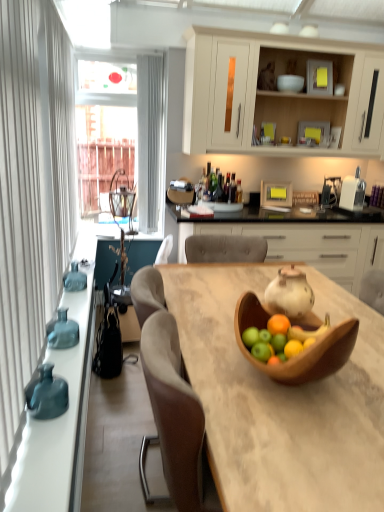
Question: Is matte white cabinet at upper center, marked as the first cabinetry in a top-to-bottom arrangement, inside wooden table at center?

Choices:
 (A) no
 (B) yes

Answer: (A)

Question: Is wooden table at center positioned in front of matte white cabinet at upper center, which appears as the second cabinetry when ordered from the bottom?

Choices:
 (A) yes
 (B) no

Answer: (A)

Question: Is the position of wooden table at center more distant than that of matte white cabinet at upper center, marked as the first cabinetry in a top-to-bottom arrangement?

Choices:
 (A) yes
 (B) no

Answer: (B)

Question: Are wooden table at center and matte white cabinet at upper center, which appears as the second cabinetry when ordered from the bottom, located far from each other?

Choices:
 (A) no
 (B) yes

Answer: (B)

Question: Can you confirm if wooden table at center is shorter than matte white cabinet at upper center, which appears as the second cabinetry when ordered from the bottom?

Choices:
 (A) yes
 (B) no

Answer: (A)

Question: Is wooden table at center wider than matte white cabinet at upper center, which appears as the second cabinetry when ordered from the bottom?

Choices:
 (A) no
 (B) yes

Answer: (B)

Question: Is matte white teapot at center completely or partially inside teal glass vase at left, which is counted as the first vase, starting from the back?

Choices:
 (A) no
 (B) yes

Answer: (A)

Question: From the image's perspective, is teal glass vase at left, the 1th vase viewed from the top, beneath matte white teapot at center?

Choices:
 (A) yes
 (B) no

Answer: (B)

Question: Is the surface of teal glass vase at left, the 1th vase viewed from the top, in direct contact with matte white teapot at center?

Choices:
 (A) no
 (B) yes

Answer: (A)

Question: Can you confirm if teal glass vase at left, the 1th vase viewed from the top, is bigger than matte white teapot at center?

Choices:
 (A) no
 (B) yes

Answer: (A)

Question: From the image's perspective, does teal glass vase at left, which is counted as the first vase, starting from the back, appear higher than matte white teapot at center?

Choices:
 (A) yes
 (B) no

Answer: (A)

Question: Can you confirm if teal glass vase at left, which is the third vase in bottom-to-top order, is smaller than matte white teapot at center?

Choices:
 (A) yes
 (B) no

Answer: (A)

Question: From the image's perspective, is teal glass vase at left, which is the third vase in bottom-to-top order, located above wooden bowl at center?

Choices:
 (A) no
 (B) yes

Answer: (B)